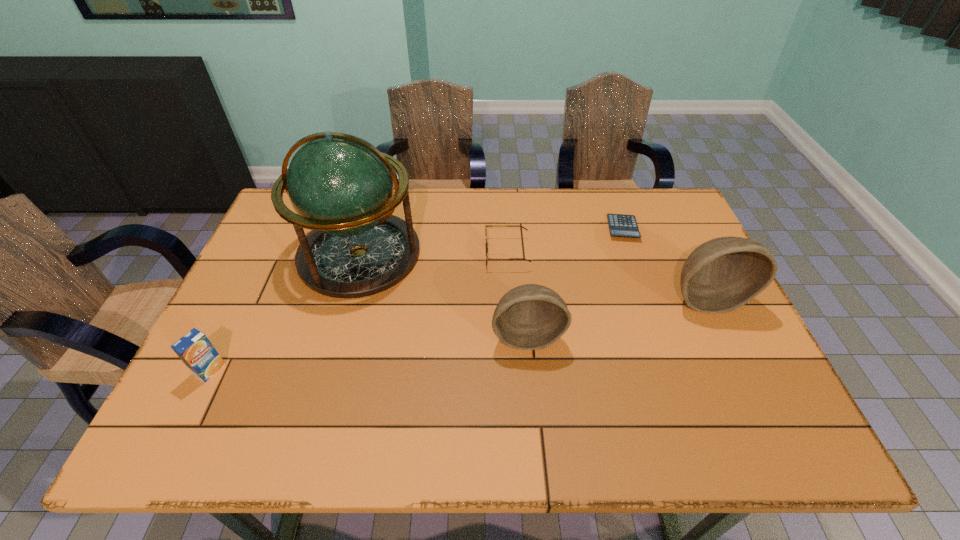
Where is `object positioned at the near edge`? The height and width of the screenshot is (540, 960). object positioned at the near edge is located at coordinates (x=196, y=351).

Find the location of a particular element. globe situated at the left edge is located at coordinates (341, 187).

This screenshot has height=540, width=960. What are the coordinates of `orange_juice located at the left edge` in the screenshot? It's located at (196, 351).

The image size is (960, 540). Identify the location of bowl that is at the right edge. click(x=721, y=275).

I want to click on calculator that is positioned at the right edge, so pyautogui.click(x=621, y=225).

Identify the location of object that is positioned at the far left corner. Image resolution: width=960 pixels, height=540 pixels. (341, 187).

In order to click on object that is at the near left corner in this screenshot , I will do `click(196, 351)`.

Where is `object that is at the far right corner`? The width and height of the screenshot is (960, 540). object that is at the far right corner is located at coordinates (621, 225).

Locate an element on the screen. vacant area at the far edge of the desktop is located at coordinates (453, 233).

Where is `free space at the near edge of the desktop`? free space at the near edge of the desktop is located at coordinates (344, 391).